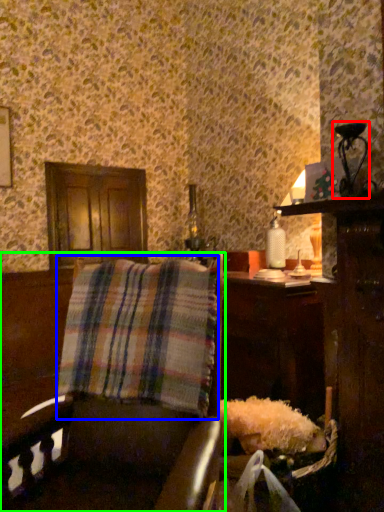
Question: Considering the real-world distances, which object is closest to table lamp (highlighted by a red box)? plaid (highlighted by a blue box) or furniture (highlighted by a green box).

Choices:
 (A) plaid
 (B) furniture

Answer: (A)